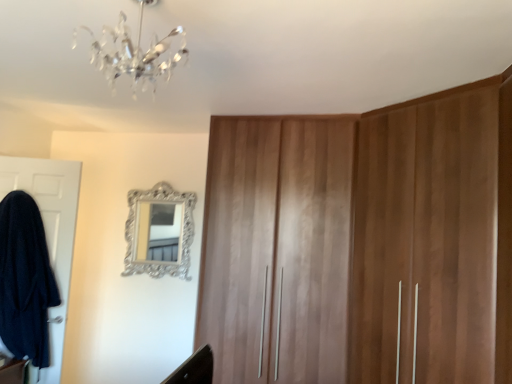
Question: Does silver ornate mirror at upper center turn towards crystal glass chandelier at upper center?

Choices:
 (A) no
 (B) yes

Answer: (B)

Question: Is crystal glass chandelier at upper center completely or partially inside silver ornate mirror at upper center?

Choices:
 (A) no
 (B) yes

Answer: (A)

Question: Is crystal glass chandelier at upper center at the back of silver ornate mirror at upper center?

Choices:
 (A) no
 (B) yes

Answer: (A)

Question: Does silver ornate mirror at upper center come in front of crystal glass chandelier at upper center?

Choices:
 (A) yes
 (B) no

Answer: (B)

Question: Is silver ornate mirror at upper center in contact with crystal glass chandelier at upper center?

Choices:
 (A) yes
 (B) no

Answer: (B)

Question: Does silver ornate mirror at upper center lie behind crystal glass chandelier at upper center?

Choices:
 (A) yes
 (B) no

Answer: (A)

Question: Is silver ornate mirror at upper center looking in the opposite direction of white matte door at left?

Choices:
 (A) yes
 (B) no

Answer: (B)

Question: Is silver ornate mirror at upper center at the right side of white matte door at left?

Choices:
 (A) no
 (B) yes

Answer: (B)

Question: From the image's perspective, is silver ornate mirror at upper center beneath white matte door at left?

Choices:
 (A) yes
 (B) no

Answer: (B)

Question: Is silver ornate mirror at upper center next to white matte door at left and touching it?

Choices:
 (A) yes
 (B) no

Answer: (B)

Question: Does silver ornate mirror at upper center have a greater height compared to white matte door at left?

Choices:
 (A) yes
 (B) no

Answer: (B)

Question: Does silver ornate mirror at upper center come behind white matte door at left?

Choices:
 (A) yes
 (B) no

Answer: (A)

Question: Considering the relative sizes of silver ornate mirror at upper center and wooden wardrobe at center in the image provided, is silver ornate mirror at upper center wider than wooden wardrobe at center?

Choices:
 (A) yes
 (B) no

Answer: (B)